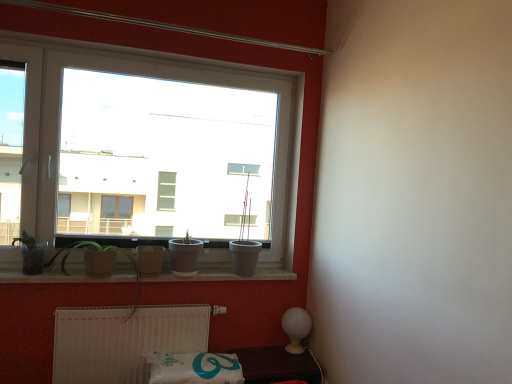
Question: Considering the relative sizes of white plastic window at upper left and white plastic radiator at lower center in the image provided, is white plastic window at upper left taller than white plastic radiator at lower center?

Choices:
 (A) yes
 (B) no

Answer: (A)

Question: From a real-world perspective, is white plastic window at upper left on top of white plastic radiator at lower center?

Choices:
 (A) no
 (B) yes

Answer: (B)

Question: Can you confirm if white plastic window at upper left is smaller than white plastic radiator at lower center?

Choices:
 (A) no
 (B) yes

Answer: (A)

Question: From the image's perspective, does white plastic window at upper left appear higher than white plastic radiator at lower center?

Choices:
 (A) no
 (B) yes

Answer: (B)

Question: Is white plastic window at upper left shorter than white plastic radiator at lower center?

Choices:
 (A) no
 (B) yes

Answer: (A)

Question: Is white plastic window at upper left not inside white plastic radiator at lower center?

Choices:
 (A) yes
 (B) no

Answer: (A)

Question: Could green matte plant at lower left, acting as the 2th plant starting from the left, be considered to be inside matte glass pot at left, which appears as the second plant when viewed from the right?

Choices:
 (A) no
 (B) yes

Answer: (A)

Question: Is matte glass pot at left, the first plant positioned from the left, bigger than green matte plant at lower left, acting as the 2th plant starting from the left?

Choices:
 (A) no
 (B) yes

Answer: (A)

Question: Can you confirm if matte glass pot at left, the first plant positioned from the left, is shorter than green matte plant at lower left, acting as the 2th plant starting from the left?

Choices:
 (A) no
 (B) yes

Answer: (B)

Question: From the image's perspective, is matte glass pot at left, which appears as the second plant when viewed from the right, above green matte plant at lower left, acting as the 2th plant starting from the left?

Choices:
 (A) yes
 (B) no

Answer: (A)

Question: Could you tell me if matte glass pot at left, the first plant positioned from the left, is turned towards green matte plant at lower left, acting as the 2th plant starting from the left?

Choices:
 (A) no
 (B) yes

Answer: (A)

Question: From a real-world perspective, is matte glass pot at left, which appears as the second plant when viewed from the right, over green matte plant at lower left, the 1th plant positioned from the right?

Choices:
 (A) yes
 (B) no

Answer: (A)

Question: Is white plastic window at upper left completely or partially inside white glossy lamp at lower right?

Choices:
 (A) yes
 (B) no

Answer: (B)